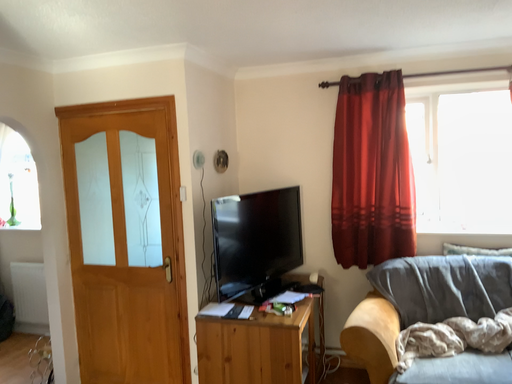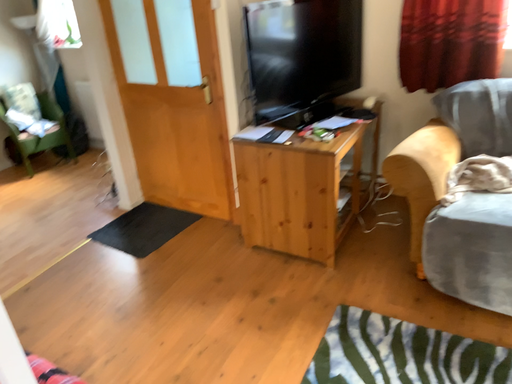
Question: How did the camera likely rotate when shooting the video?

Choices:
 (A) rotated upward
 (B) rotated downward

Answer: (B)